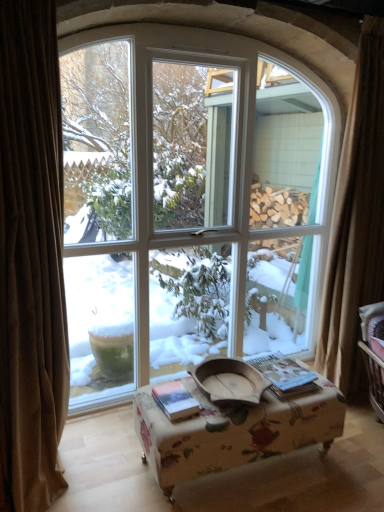
Identify the location of unoccupied region to the right of hardcover book at center, marked as the 1th book in a left-to-right arrangement. The image size is (384, 512). (214, 413).